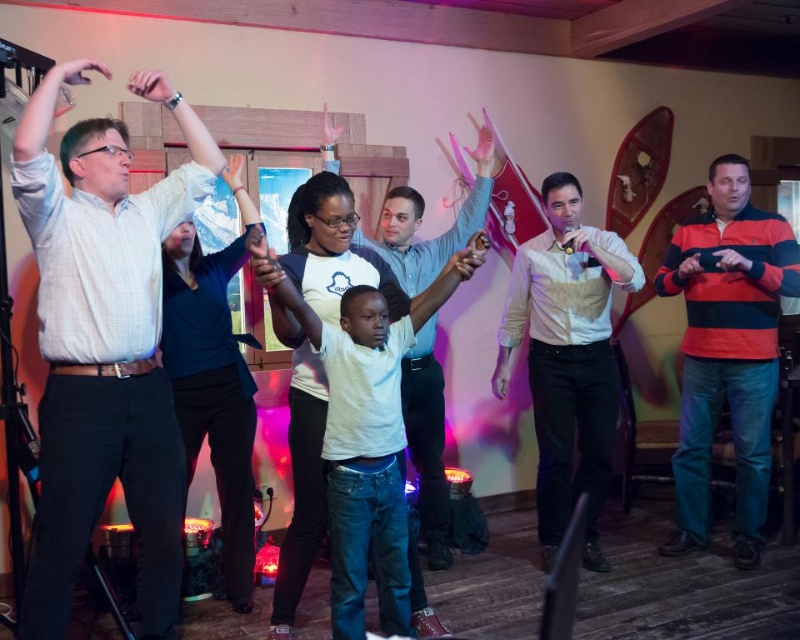
You are standing at point [308,321] and want to move to point [96,70]. Is the path clear between these two points?

Point [96,70] is behind point [308,321], so the path might be obstructed by the objects or people located between them.

You are standing at point (484, 244) and want to move to point (441, 486). Is the point you want to reach behind or in front of your current position?

The point (441, 486) is behind point (484, 244), so the desired location is behind your current position.